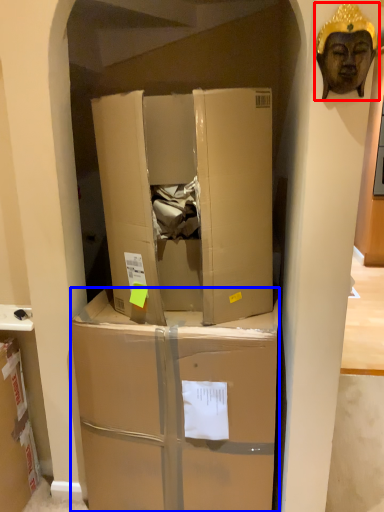
Question: Among these objects, which one is farthest to the camera, person (highlighted by a red box) or box (highlighted by a blue box)?

Choices:
 (A) person
 (B) box

Answer: (B)